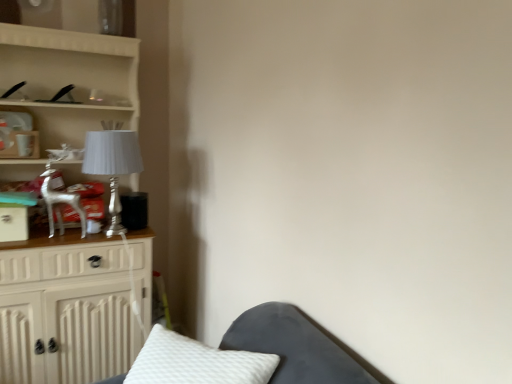
Question: Can you confirm if white glossy cabinet at left is shorter than silver metallic table lamp at left?

Choices:
 (A) yes
 (B) no

Answer: (B)

Question: Does white glossy cabinet at left touch silver metallic table lamp at left?

Choices:
 (A) yes
 (B) no

Answer: (B)

Question: Is white glossy cabinet at left bigger than silver metallic table lamp at left?

Choices:
 (A) no
 (B) yes

Answer: (B)

Question: From the image's perspective, is white glossy cabinet at left beneath silver metallic table lamp at left?

Choices:
 (A) no
 (B) yes

Answer: (B)

Question: Is white glossy cabinet at left outside silver metallic table lamp at left?

Choices:
 (A) no
 (B) yes

Answer: (B)

Question: Would you consider white glossy cabinet at left to be distant from silver metallic table lamp at left?

Choices:
 (A) no
 (B) yes

Answer: (A)

Question: Does silver metallic table lamp at left have a larger size compared to white glossy cabinet at left?

Choices:
 (A) no
 (B) yes

Answer: (A)

Question: Is silver metallic table lamp at left surrounding white glossy cabinet at left?

Choices:
 (A) no
 (B) yes

Answer: (A)

Question: From a real-world perspective, is silver metallic table lamp at left located beneath white glossy cabinet at left?

Choices:
 (A) yes
 (B) no

Answer: (B)

Question: From the image's perspective, is silver metallic table lamp at left on white glossy cabinet at left?

Choices:
 (A) yes
 (B) no

Answer: (A)

Question: Is silver metallic table lamp at left far away from white glossy cabinet at left?

Choices:
 (A) yes
 (B) no

Answer: (B)

Question: Considering the relative sizes of silver metallic table lamp at left and white glossy cabinet at left in the image provided, is silver metallic table lamp at left shorter than white glossy cabinet at left?

Choices:
 (A) yes
 (B) no

Answer: (A)

Question: Is white glossy cabinet at left bigger or smaller than silver metallic table lamp at left?

Choices:
 (A) small
 (B) big

Answer: (B)